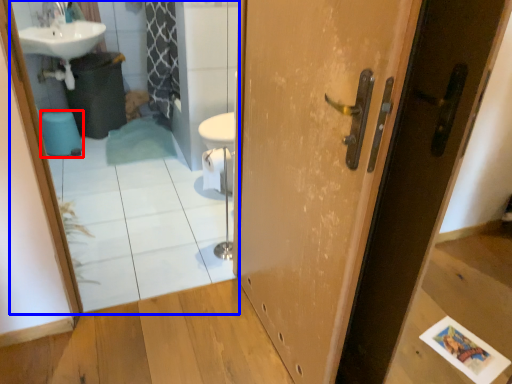
Question: Among these objects, which one is farthest to the camera, toilet bowl (highlighted by a red box) or mirror (highlighted by a blue box)?

Choices:
 (A) toilet bowl
 (B) mirror

Answer: (A)